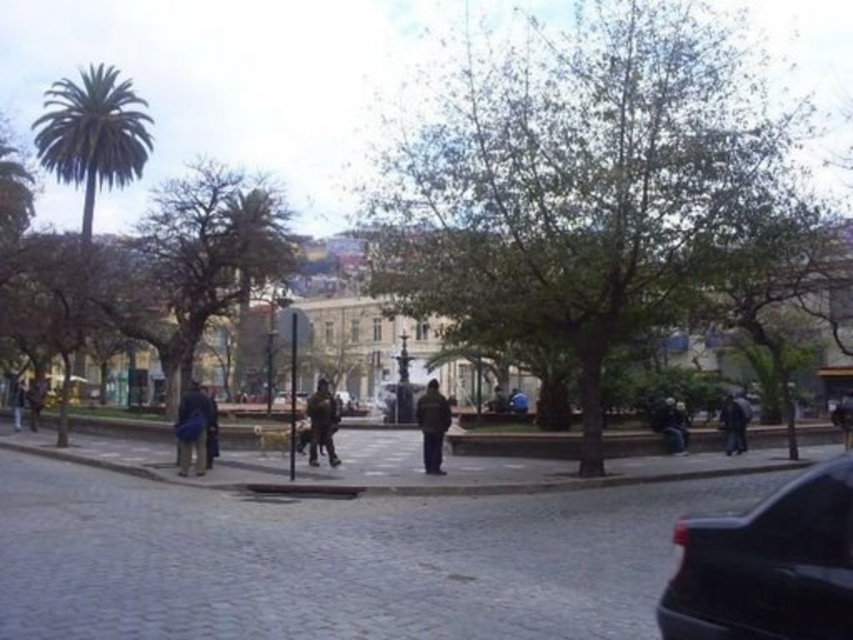
Question: Which point is farther to the camera?

Choices:
 (A) dark blue fabric bag at lower left
 (B) shiny black car at lower right
 (C) green leafy palm tree at left
 (D) dark blue jeans at center

Answer: (D)

Question: Which is nearer to the dark blue jacket at center?

Choices:
 (A) dark blue jeans at center
 (B) green leafy palm tree at left
 (C) dark brown leather jacket at center
 (D) dark brown leather jacket at lower left

Answer: (A)

Question: Can you confirm if green leafy tree at left is bigger than dark brown leather jacket at center?

Choices:
 (A) yes
 (B) no

Answer: (A)

Question: Which of these objects is positioned farthest from the dark brown leather jacket at center?

Choices:
 (A) green leafy tree at center
 (B) dark brown leather jacket at lower left

Answer: (B)

Question: From the image, what is the correct spatial relationship of shiny black car at lower right in relation to green leafy palm tree at left?

Choices:
 (A) right
 (B) left

Answer: (A)

Question: In this image, where is gray cobblestone pavement at center located relative to dark blue jacket at center?

Choices:
 (A) below
 (B) above

Answer: (B)